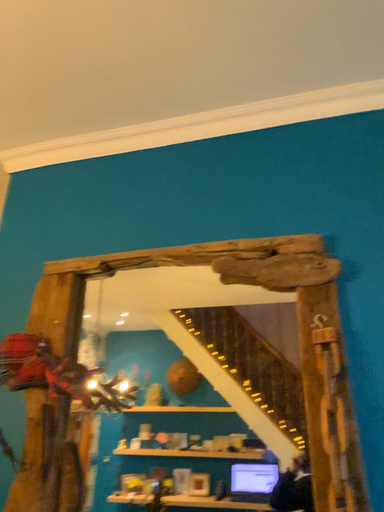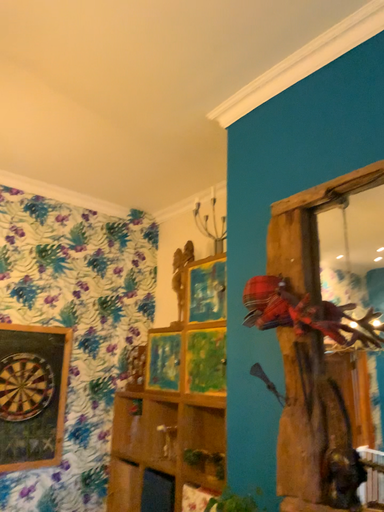
Question: How did the camera likely rotate when shooting the video?

Choices:
 (A) rotated upward
 (B) rotated downward

Answer: (B)